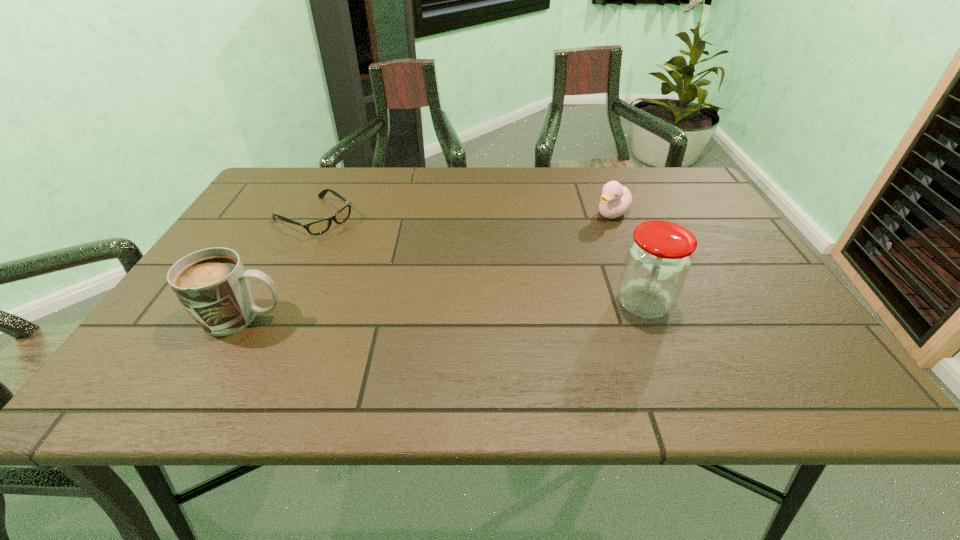
Where is `free space located on the front-facing side of the spectacles`? Image resolution: width=960 pixels, height=540 pixels. free space located on the front-facing side of the spectacles is located at coordinates (350, 240).

Where is `free location located on the front-facing side of the spectacles`? The image size is (960, 540). free location located on the front-facing side of the spectacles is located at coordinates (401, 272).

Identify the location of duckling located at the far edge. The height and width of the screenshot is (540, 960). (615, 200).

Find the location of a particular element. Image resolution: width=960 pixels, height=540 pixels. spectacles that is at the far edge is located at coordinates (318, 227).

Identify the location of mug at the near edge. The width and height of the screenshot is (960, 540). (212, 284).

This screenshot has width=960, height=540. In order to click on jar that is at the near edge in this screenshot , I will do `click(658, 259)`.

Locate an element on the screen. Image resolution: width=960 pixels, height=540 pixels. mug that is at the left edge is located at coordinates (212, 284).

I want to click on spectacles that is at the left edge, so click(x=318, y=227).

At what (x,y) coordinates should I click in order to perform the action: click on object present at the far left corner. Please return your answer as a coordinate pair (x, y). The height and width of the screenshot is (540, 960). Looking at the image, I should click on (318, 227).

Identify the location of object that is at the near left corner. Image resolution: width=960 pixels, height=540 pixels. (212, 284).